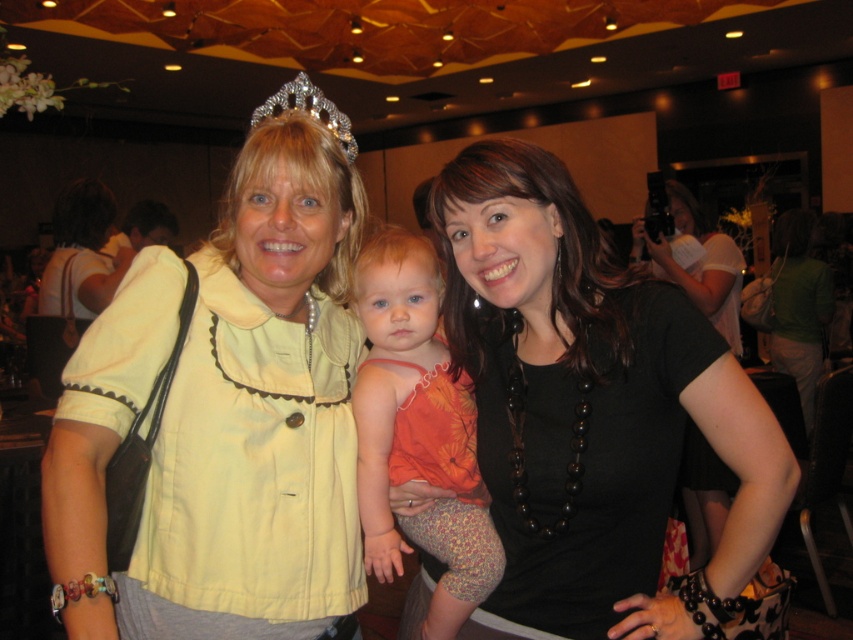
You are a photographer at the event and need to capture a photo that includes both the orange fabric dress at center and the sparkling silver tiara at upper center. Which object should you focus on first to ensure both are in frame?

The orange fabric dress at center is below the sparkling silver tiara at upper center, so you should focus on the sparkling silver tiara at upper center first to ensure both are in frame.

You are a guest at the event and want to take a photo with the two fabrics. Which fabric should you stand closer to if you want both the yellow fabric at center and the orange fabric dress at center to be visible in the frame?

You should stand closer to the orange fabric dress at center because the yellow fabric at center is taller than the orange fabric dress at center. This way, both will be within the camera frame without one being too large or small compared to the other.

Please provide the 2D coordinates of the yellow fabric at center in the image. The coordinates should be in the format of a point with two decimal places, like point 0.5,0.5.

The yellow fabric at center is located at point (227,410).